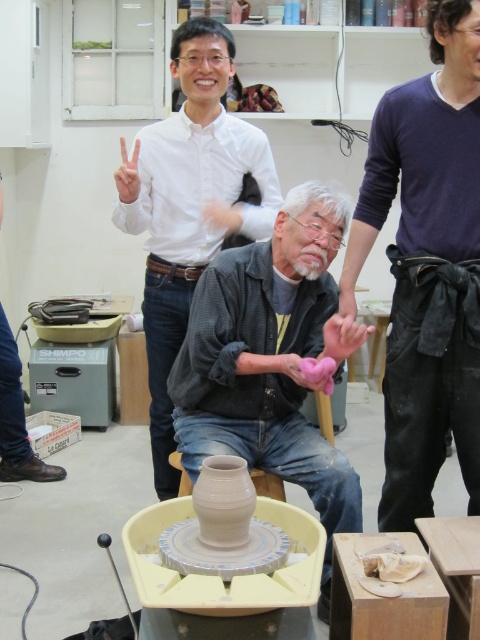
Question: Can you confirm if dark blue sweater at center is positioned above white glossy shirt at upper center?

Choices:
 (A) no
 (B) yes

Answer: (A)

Question: Among these points, which one is nearest to the camera?

Choices:
 (A) (247, 387)
 (B) (146, 173)

Answer: (A)

Question: Can you confirm if matte gray sweater at center is smaller than white glossy shirt at upper center?

Choices:
 (A) no
 (B) yes

Answer: (B)

Question: Is dark blue sweater at center smaller than matte gray sweater at center?

Choices:
 (A) no
 (B) yes

Answer: (B)

Question: Which point is closer to the camera taking this photo?

Choices:
 (A) (250, 221)
 (B) (324, 371)
 (C) (408, 225)

Answer: (C)

Question: Among these objects, which one is farthest from the camera?

Choices:
 (A) white glossy shirt at upper center
 (B) dark blue sweater at center

Answer: (A)